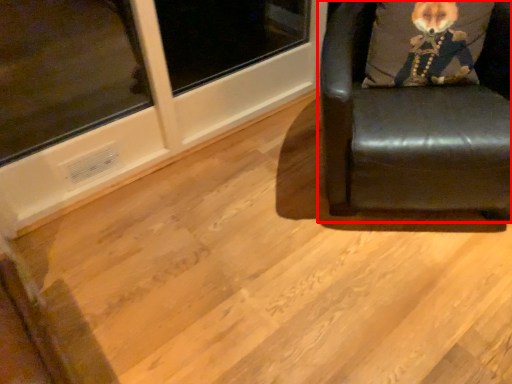
Question: From the image's perspective, considering the relative positions of chair (annotated by the red box) and throw pillow in the image provided, where is chair (annotated by the red box) located with respect to the staircase?

Choices:
 (A) below
 (B) above

Answer: (A)